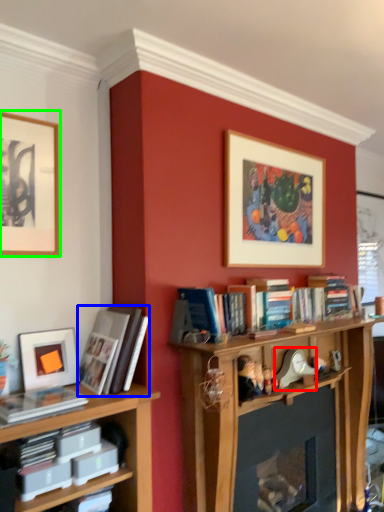
Question: Which is farther away from toy (highlighted by a red box)? book (highlighted by a blue box) or picture frame (highlighted by a green box)?

Choices:
 (A) book
 (B) picture frame

Answer: (B)